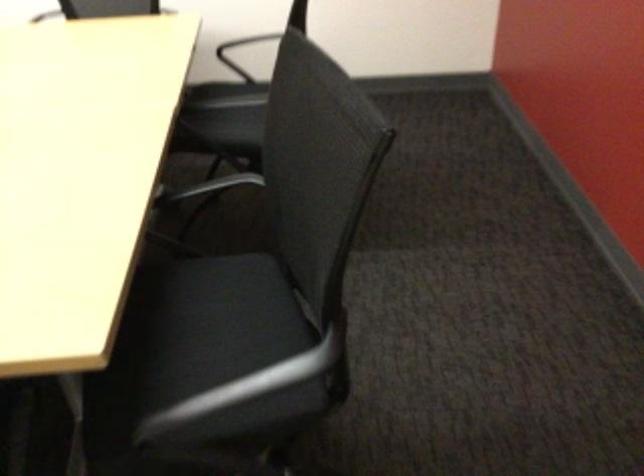
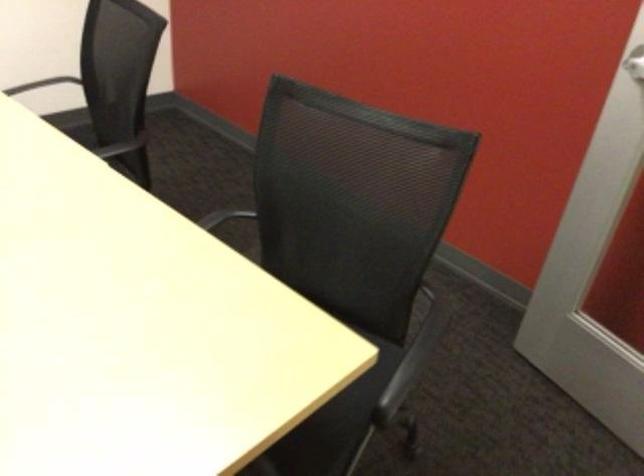
Locate, in the second image, the point that corresponds to point (238, 179) in the first image.

(223, 217)